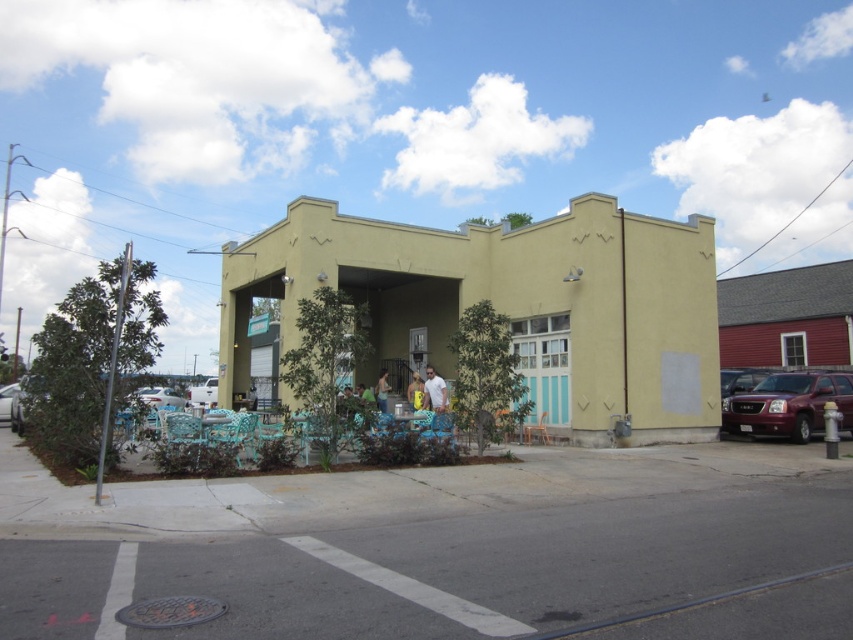
You are standing at the origin point of the image coordinate system. Where is the yellow stucco building at center located?

The yellow stucco building at center is located at point (500, 308).

You are a pedestrian standing in front of the building and want to cross the street safely. There are two vehicles nearby, a white matte truck at left and a silver metallic car at left. Which vehicle is closer to the building? Please explain your reasoning based on the scene description.

The white matte truck at left is located below the silver metallic car at left, meaning it is positioned closer to the building. Therefore, the white matte truck at left is closer to the building than the silver metallic car at left.